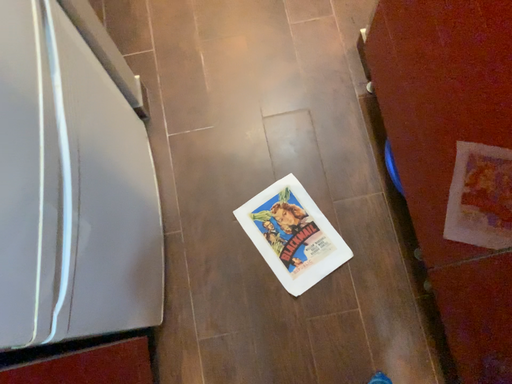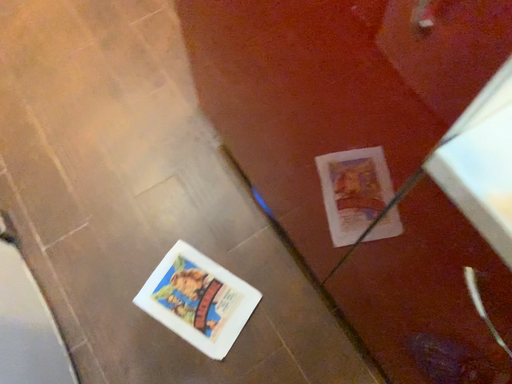
Question: How did the camera likely rotate when shooting the video?

Choices:
 (A) rotated downward
 (B) rotated upward

Answer: (B)